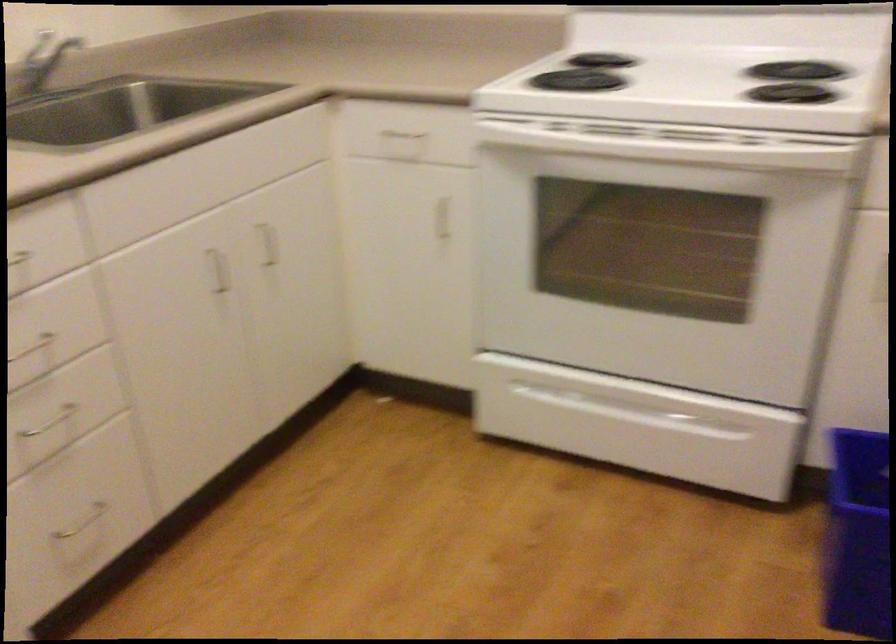
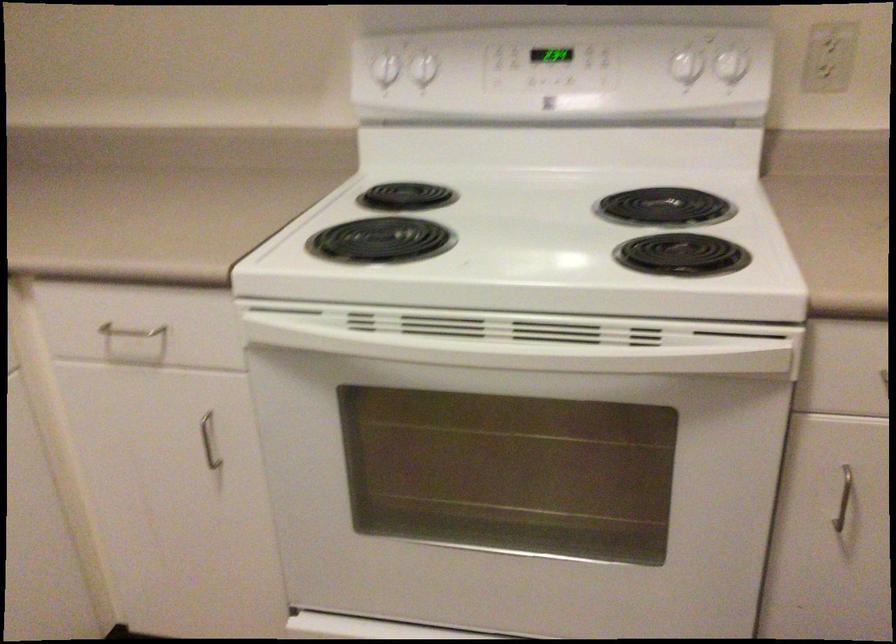
Find the pixel in the second image that matches the point at 400,144 in the first image.

(136, 337)